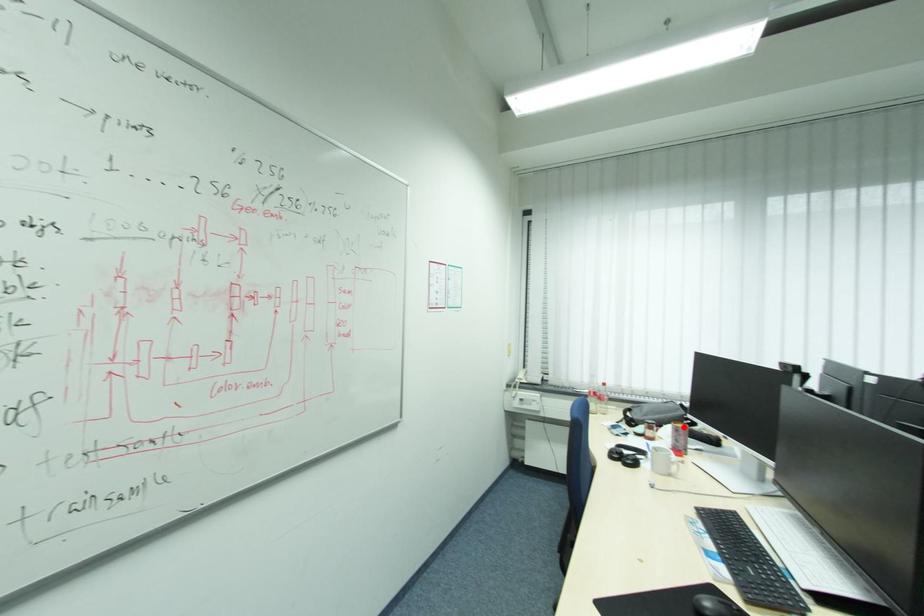
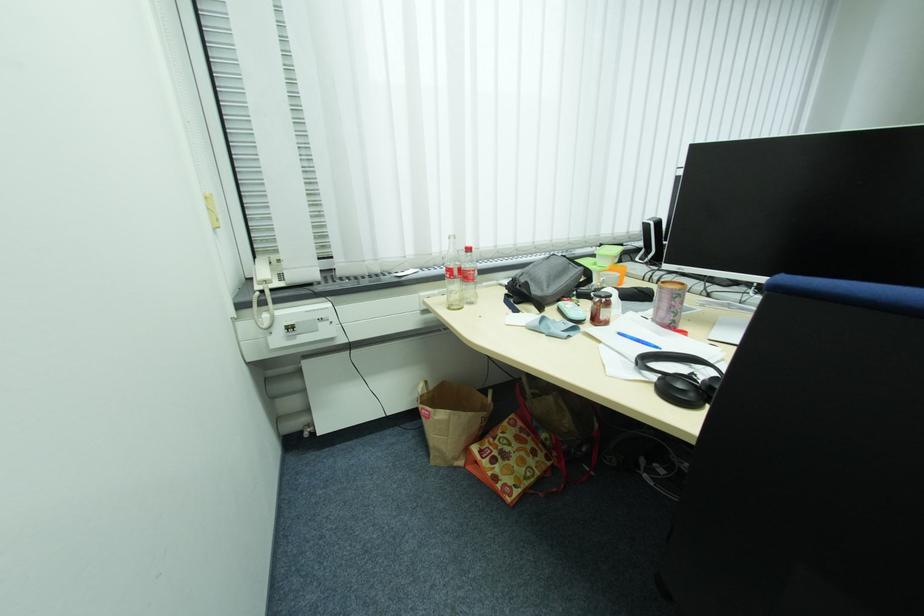
Find the pixel in the second image that matches the highlighted location in the first image.

(687, 290)